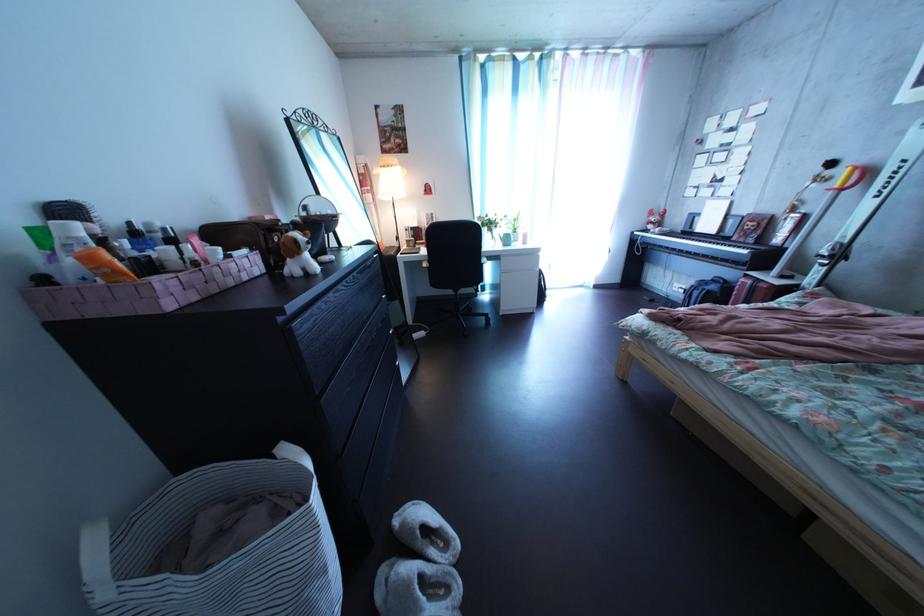
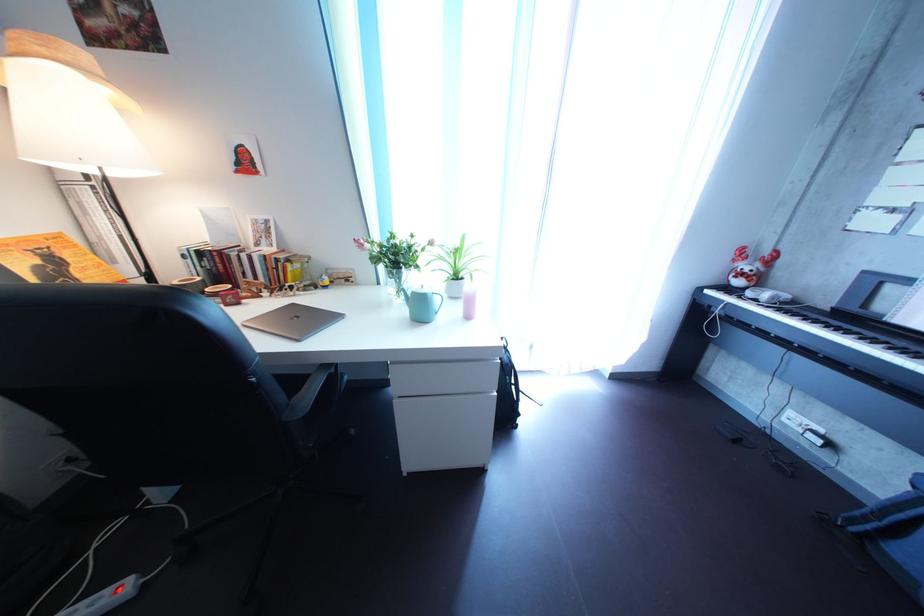
The point at (681, 237) is marked in the first image. Where is the corresponding point in the second image?

(801, 304)